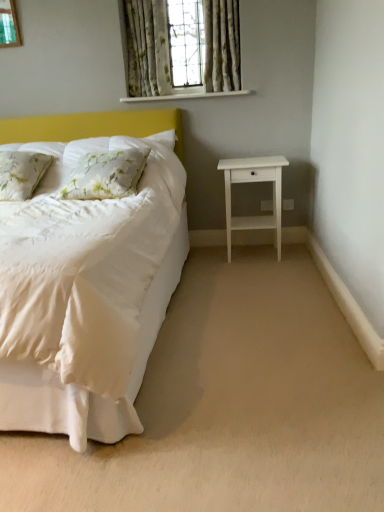
Question: Does point (226, 226) appear closer or farther from the camera than point (109, 170)?

Choices:
 (A) closer
 (B) farther

Answer: (B)

Question: Visually, is white matte nightstand at right positioned to the left or to the right of floral fabric pillow at left, marked as the second pillow in a left-to-right arrangement?

Choices:
 (A) right
 (B) left

Answer: (A)

Question: Estimate the real-world distances between objects in this image. Which object is closer to the floral fabric curtain at upper center, placed as the 2th curtain when sorted from right to left?

Choices:
 (A) floral fabric pillow at left, arranged as the first pillow when viewed from the right
 (B) floral fabric curtain at upper center, the 2th curtain viewed from the left
 (C) beige carpet at lower center
 (D) green floral curtains at upper center
 (E) white matte nightstand at right

Answer: (D)

Question: Considering the real-world distances, which object is farthest from the floral fabric curtain at upper center, placed as the 2th curtain when sorted from right to left?

Choices:
 (A) white matte nightstand at right
 (B) floral fabric curtain at upper center, the 2th curtain viewed from the left
 (C) white painted wood at upper center
 (D) beige carpet at lower center
 (E) green floral curtains at upper center

Answer: (D)